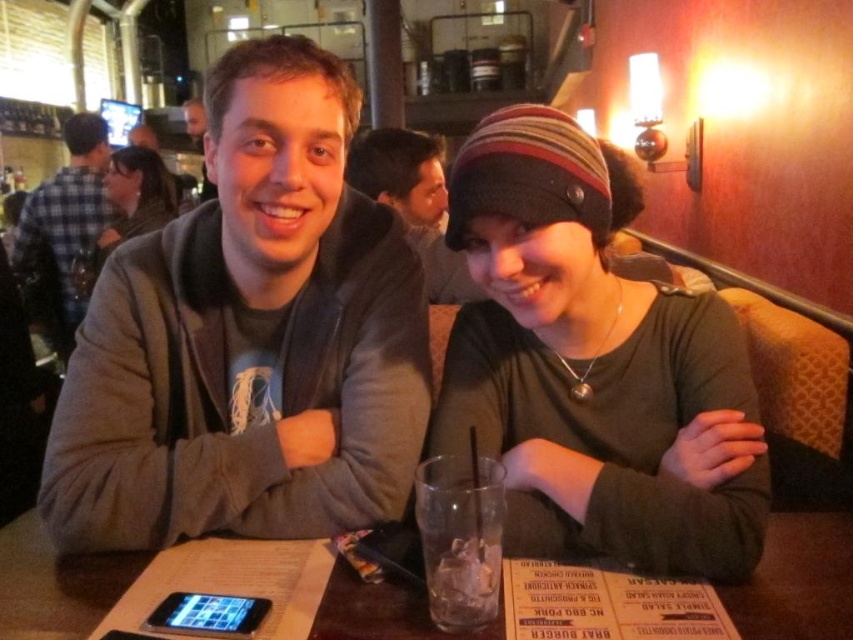
Who is positioned more to the left, wooden table at center or matte gray hoodie at upper left?

matte gray hoodie at upper left is more to the left.

Is point (813, 618) in front of point (381, 179)?

That is True.

You are a GUI agent. You are given a task and a screenshot of the screen. Output one action in this format:
    pyautogui.click(x=<x>, y=<y>)
    Task: Click on the wooden table at center
    
    Given the screenshot: What is the action you would take?
    pyautogui.click(x=798, y=580)

Does matte gray hoodie at upper left have a lesser width compared to matte black beanie at upper center?

Indeed, matte gray hoodie at upper left has a lesser width compared to matte black beanie at upper center.

Is point (383, 179) positioned after point (123, 173)?

No, (383, 179) is in front of (123, 173).

Describe the element at coordinates (413, 200) in the screenshot. I see `matte gray hoodie at upper left` at that location.

Identify the location of matte gray hoodie at upper left. The height and width of the screenshot is (640, 853). pos(413,200).

Can you confirm if knit cap at center is positioned to the right of black glossy smartphone at lower left?

Yes, knit cap at center is to the right of black glossy smartphone at lower left.

You are a GUI agent. You are given a task and a screenshot of the screen. Output one action in this format:
    pyautogui.click(x=<x>, y=<y>)
    Task: Click on the knit cap at center
    The image size is (853, 640).
    Given the screenshot: What is the action you would take?
    589,362

The image size is (853, 640). What are the coordinates of `knit cap at center` in the screenshot? It's located at (589, 362).